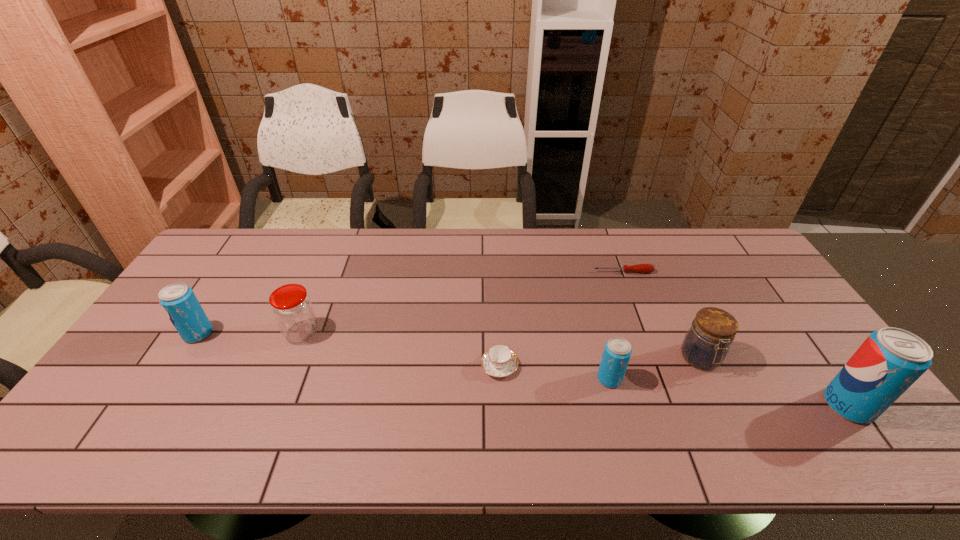
To ensure equal spacing by inserting another pop_(soda) among them, please point out a vacant spot for this new pop_(soda). Please provide its 2D coordinates. Your answer should be formatted as a tuple, i.e. [(x, y)], where the tuple contains the x and y coordinates of a point satisfying the conditions above.

[(394, 355)]